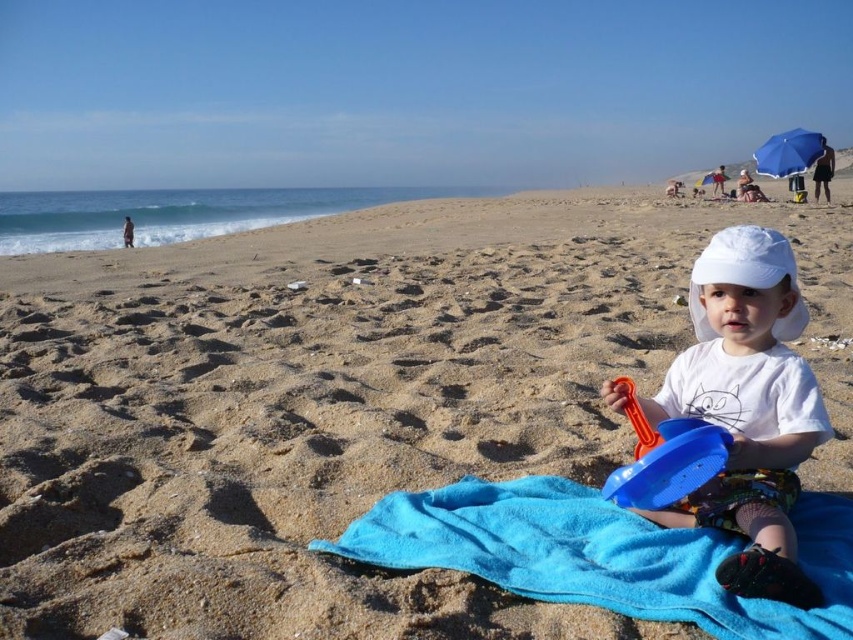
You are a photographer trying to capture a shot of the beach scene. You need to position yourself so that both the blue fabric towel at center and the blue soft towel at lower center are visible in the frame. Based on their positions, which direction should you move to ensure both towels are in the shot?

The blue fabric towel at center is to the right of the blue soft towel at lower center. To include both in the frame, you should move to the left side so that you can capture the blue soft towel at lower center on the left and the blue fabric towel at center on the right.